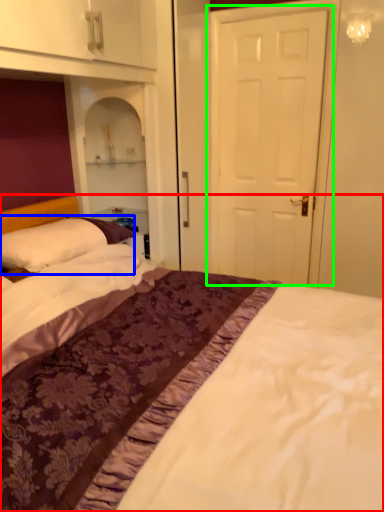
Question: Based on their relative distances, which object is nearer to bed (highlighted by a red box)? Choose from pillow (highlighted by a blue box) and door (highlighted by a green box).

Choices:
 (A) pillow
 (B) door

Answer: (A)